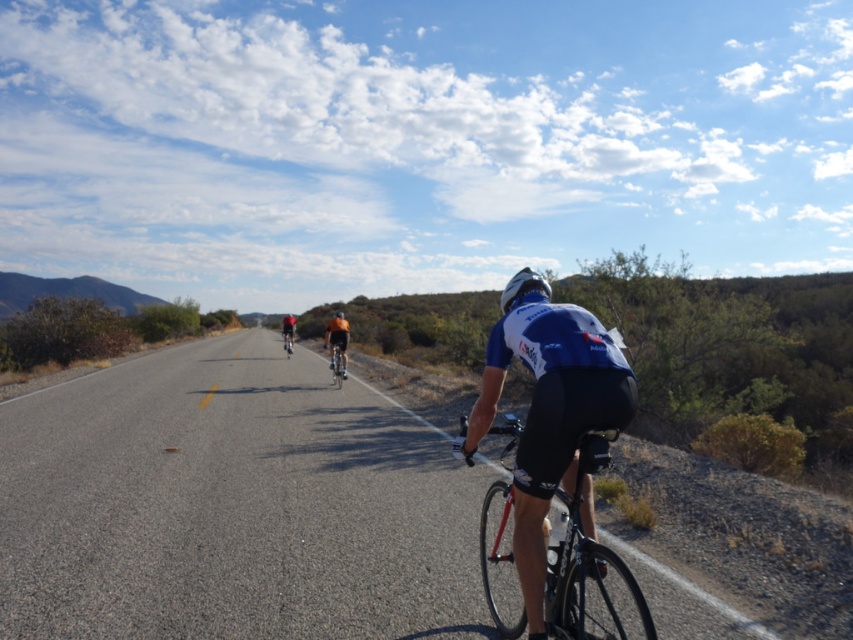
Question: From the image, what is the correct spatial relationship of shiny orange helmet at center in relation to shiny metallic bicycle at center?

Choices:
 (A) below
 (B) above

Answer: (B)

Question: Which object is the farthest from the shiny black frame at center?

Choices:
 (A) shiny silver bicycle at center
 (B) shiny metallic bicycle at center
 (C) white matte bicycle helmet at center
 (D) orange fabric cyclist at center

Answer: (B)

Question: Is orange fabric cyclist at center wider than shiny metallic bicycle at center?

Choices:
 (A) yes
 (B) no

Answer: (A)

Question: Which point is farther to the camera?

Choices:
 (A) (332, 372)
 (B) (502, 632)
 (C) (331, 355)

Answer: (C)

Question: Is shiny silver bicycle at center wider than shiny metallic bicycle at center?

Choices:
 (A) yes
 (B) no

Answer: (B)

Question: Which point is farther to the camera?

Choices:
 (A) shiny orange helmet at center
 (B) shiny silver bicycle at center
 (C) white matte bicycle helmet at center

Answer: (A)